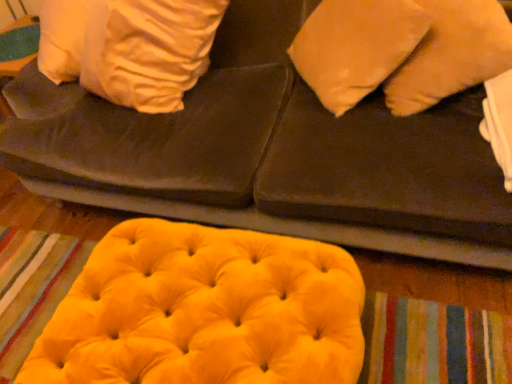
Question: Would you consider velvet yellow ottoman at lower center to be distant from velvet yellow bean bag at lower center?

Choices:
 (A) yes
 (B) no

Answer: (B)

Question: Does velvet yellow ottoman at lower center have a lesser height compared to velvet yellow bean bag at lower center?

Choices:
 (A) yes
 (B) no

Answer: (B)

Question: Considering the relative sizes of velvet yellow ottoman at lower center and velvet yellow bean bag at lower center in the image provided, is velvet yellow ottoman at lower center wider than velvet yellow bean bag at lower center?

Choices:
 (A) yes
 (B) no

Answer: (A)

Question: Does velvet yellow ottoman at lower center lie in front of velvet yellow bean bag at lower center?

Choices:
 (A) no
 (B) yes

Answer: (B)

Question: From a real-world perspective, is velvet yellow ottoman at lower center positioned under velvet yellow bean bag at lower center based on gravity?

Choices:
 (A) no
 (B) yes

Answer: (A)

Question: Can you confirm if velvet yellow ottoman at lower center is bigger than velvet yellow bean bag at lower center?

Choices:
 (A) no
 (B) yes

Answer: (B)

Question: Would you say velvet yellow ottoman at lower center is part of velvet yellow bean bag at lower center's contents?

Choices:
 (A) no
 (B) yes

Answer: (A)

Question: Can you confirm if velvet yellow bean bag at lower center is smaller than velvet yellow ottoman at lower center?

Choices:
 (A) yes
 (B) no

Answer: (A)

Question: Does velvet yellow bean bag at lower center have a lesser height compared to velvet yellow ottoman at lower center?

Choices:
 (A) yes
 (B) no

Answer: (A)

Question: From the image's perspective, is velvet yellow bean bag at lower center under velvet yellow ottoman at lower center?

Choices:
 (A) no
 (B) yes

Answer: (B)

Question: Does velvet yellow bean bag at lower center have a lesser width compared to velvet yellow ottoman at lower center?

Choices:
 (A) no
 (B) yes

Answer: (B)

Question: Does velvet yellow bean bag at lower center have a greater width compared to velvet yellow ottoman at lower center?

Choices:
 (A) no
 (B) yes

Answer: (A)

Question: Can you confirm if matte orange pillow at upper right is positioned to the left of velvet yellow ottoman at lower center?

Choices:
 (A) yes
 (B) no

Answer: (B)